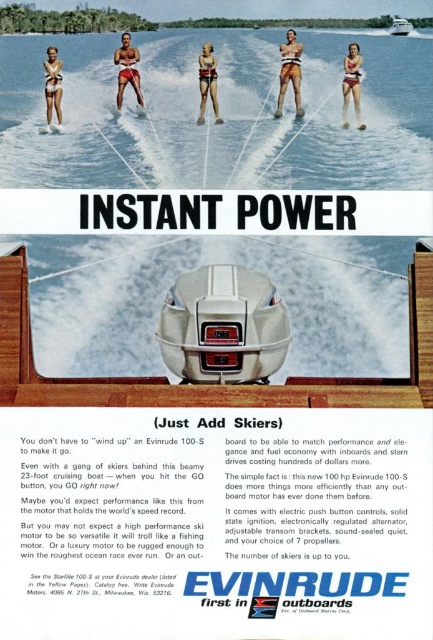
This screenshot has width=433, height=640. What do you see at coordinates (207, 83) in the screenshot? I see `matte black skis at center` at bounding box center [207, 83].

Between point (215, 122) and point (396, 28), which one is positioned behind?

Positioned behind is point (215, 122).

Is point (203, 48) positioned after point (394, 22)?

That is True.

This screenshot has height=640, width=433. What are the coordinates of `matte black skis at center` in the screenshot? It's located at (207, 83).

From the picture: Who is more forward, (296, 44) or (51, 106)?

Point (296, 44) is in front.

Does matte white swimsuit at center have a lesser height compared to matte white bikini at upper left?

Incorrect, matte white swimsuit at center's height does not fall short of matte white bikini at upper left's.

Where is `matte white swimsuit at center`? The image size is (433, 640). matte white swimsuit at center is located at coordinates (290, 72).

The width and height of the screenshot is (433, 640). In order to click on matte white swimsuit at center in this screenshot , I will do `click(290, 72)`.

Looking at this image, is white water at center positioned at the back of matte red shorts at center?

No, white water at center is in front of matte red shorts at center.

Locate an element on the screen. The image size is (433, 640). white water at center is located at coordinates (222, 113).